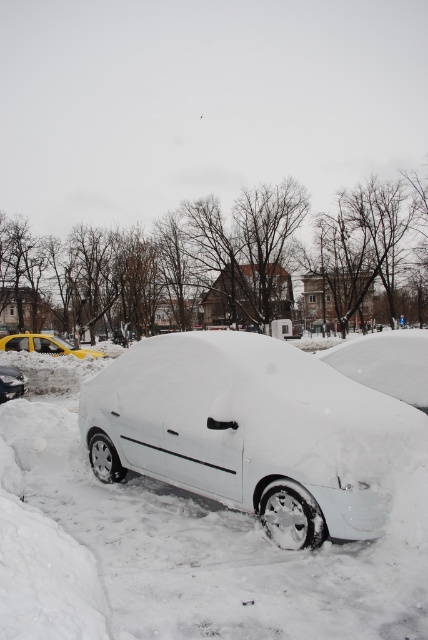
You are standing at the origin point of the coordinate system. Where is the white matte car at center located?

The white matte car at center is located at point (252,433).

You are standing at the point with coordinates point (11,369) and want to walk to the point with coordinates point (371,406). According to the image, which direction should you move to reach your destination?

You should move forward because point (371,406) is in front of point (11,369).